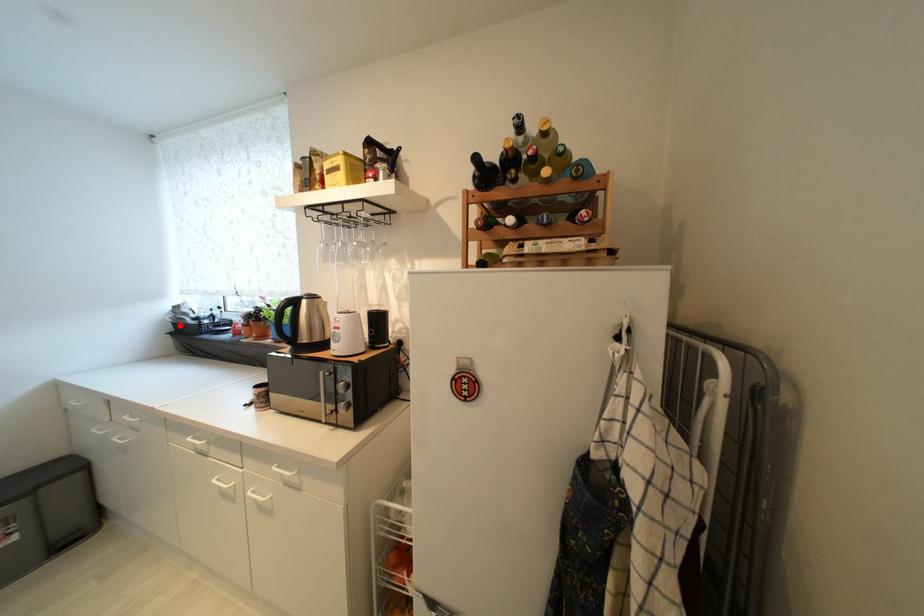
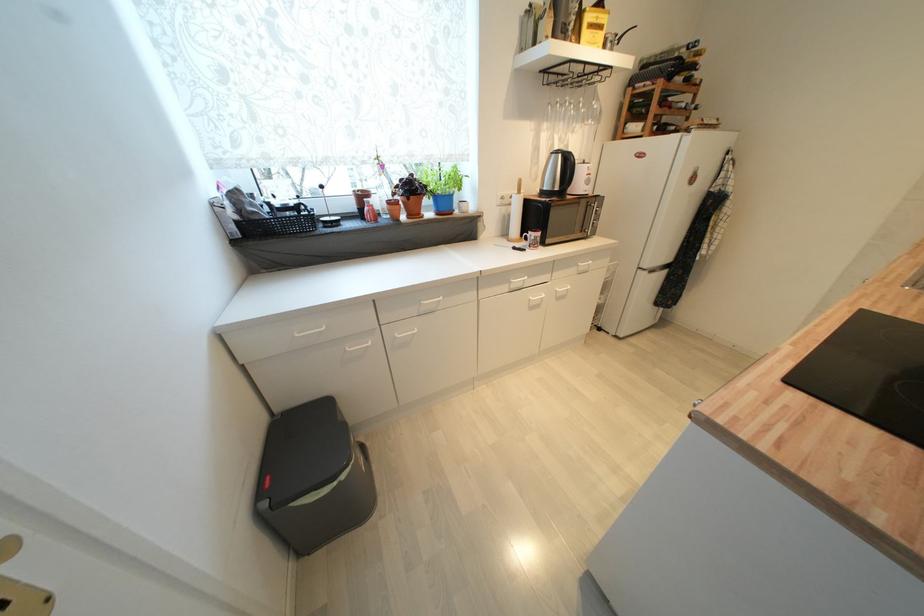
Question: I am providing you with two images of the same scene from different viewpoints. Image1 has a red point marked. In image2, the corresponding 3D location appears at what relative position? Reply with the corresponding letter.

Choices:
 (A) Closer
 (B) Farther

Answer: (A)